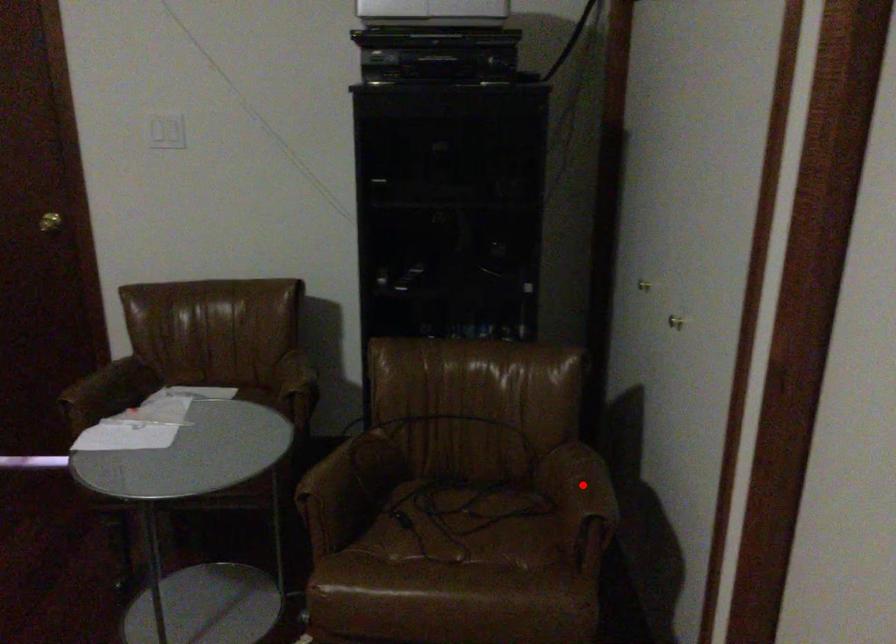
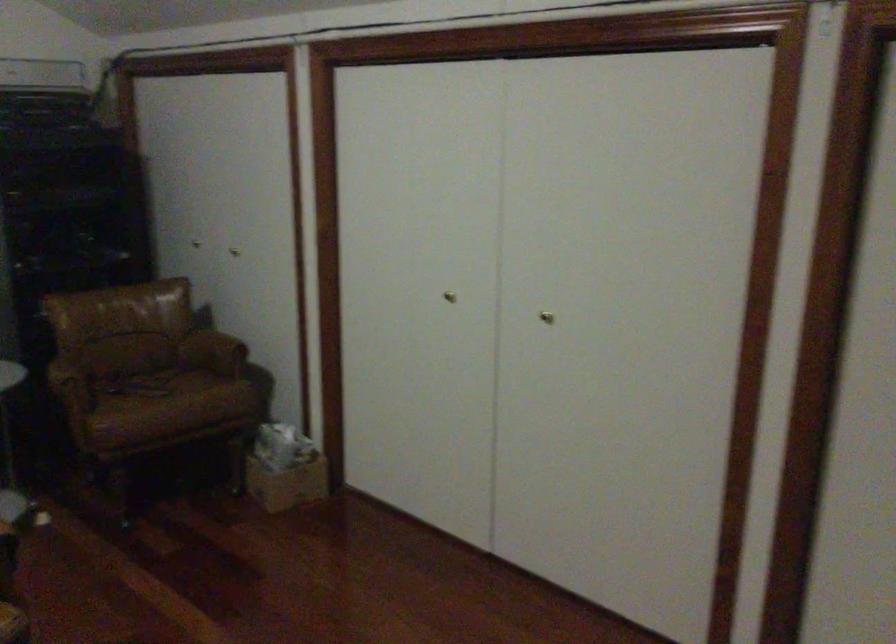
Where in the second image is the point corresponding to the highlighted location from the first image?

(220, 337)